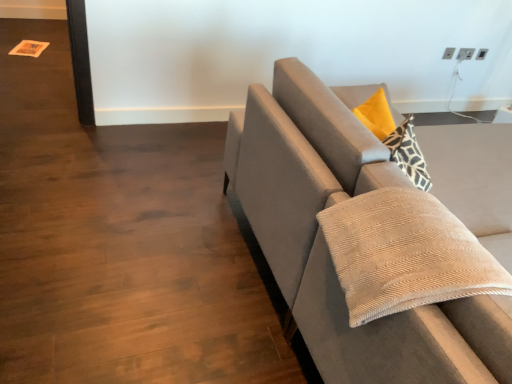
This screenshot has width=512, height=384. In order to click on vacant space positioned to the left of velvet gray couch at right in this screenshot , I will do `click(133, 230)`.